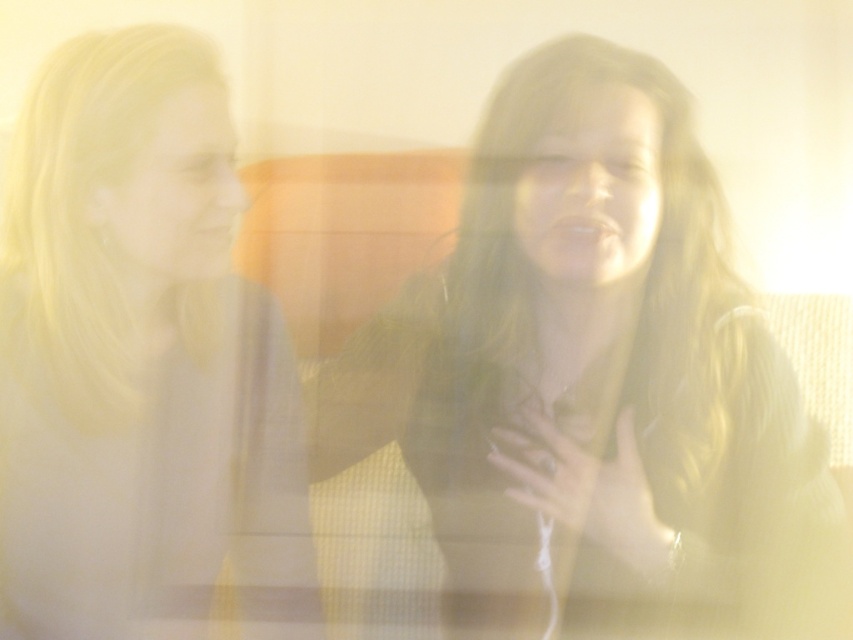
Question: Which point is farther to the camera?

Choices:
 (A) matte black shirt at center
 (B) smooth white teeth at center
 (C) matte white mouth at center

Answer: (C)

Question: Does matte black shirt at center have a smaller size compared to matte white mouth at center?

Choices:
 (A) yes
 (B) no

Answer: (B)

Question: Among these points, which one is nearest to the camera?

Choices:
 (A) (64, 241)
 (B) (221, 234)
 (C) (584, 220)
 (D) (531, 326)

Answer: (C)

Question: Does matte white shirt at left have a lesser width compared to smooth white teeth at center?

Choices:
 (A) yes
 (B) no

Answer: (B)

Question: Is matte white shirt at left positioned before matte white mouth at center?

Choices:
 (A) yes
 (B) no

Answer: (A)

Question: Among these points, which one is nearest to the camera?

Choices:
 (A) (598, 218)
 (B) (233, 230)

Answer: (A)